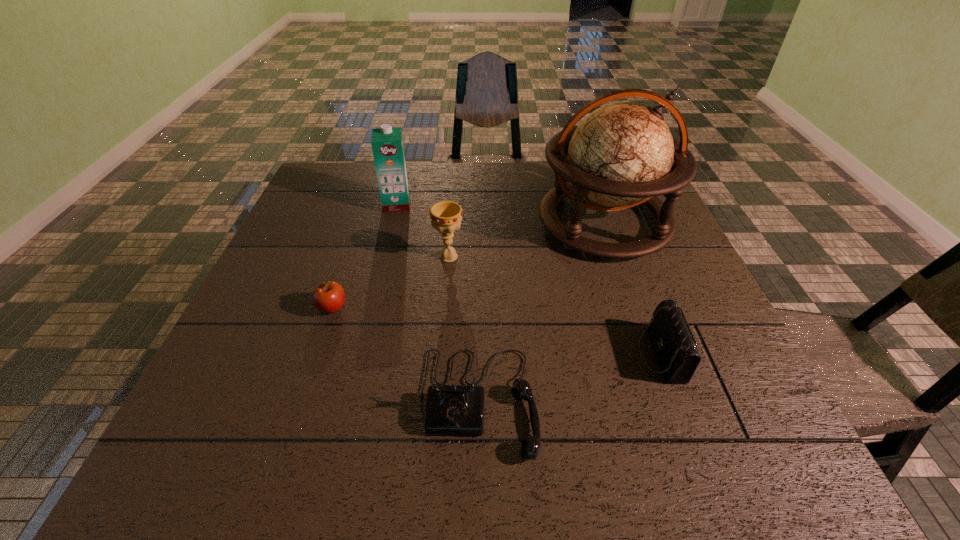
Find the location of a particular element. This screenshot has width=960, height=540. the tallest object is located at coordinates (620, 156).

This screenshot has height=540, width=960. In order to click on the second object from left to right in this screenshot , I will do `click(387, 144)`.

The width and height of the screenshot is (960, 540). In order to click on the fifth shortest object in this screenshot , I will do `click(387, 144)`.

Identify the location of chalice. (446, 216).

Locate an element on the screen. clutch bag is located at coordinates (674, 344).

You are a GUI agent. You are given a task and a screenshot of the screen. Output one action in this format:
    pyautogui.click(x=<x>, y=<y>)
    Task: Click on the third nearest object
    The height and width of the screenshot is (540, 960).
    Given the screenshot: What is the action you would take?
    pyautogui.click(x=328, y=297)

Identify the location of apple. (328, 297).

Identify the location of telephone. (458, 410).

The width and height of the screenshot is (960, 540). What are the coordinates of `vacant region located 0.190m on the left of the tallest object` in the screenshot? It's located at (470, 223).

Locate an element on the screen. The image size is (960, 540). vacant space situated 0.280m on the front of the fifth shortest object is located at coordinates (378, 280).